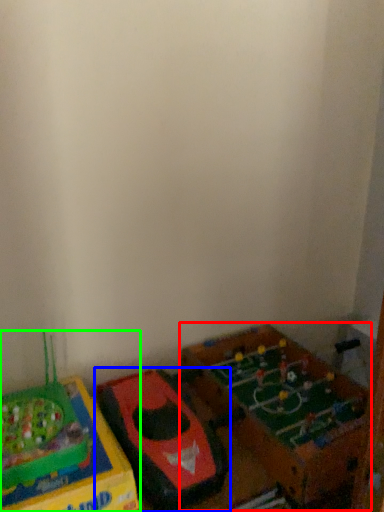
Question: Which is nearer to the toy (highlighted by a red box)? toy (highlighted by a blue box) or toy (highlighted by a green box).

Choices:
 (A) toy
 (B) toy

Answer: (A)